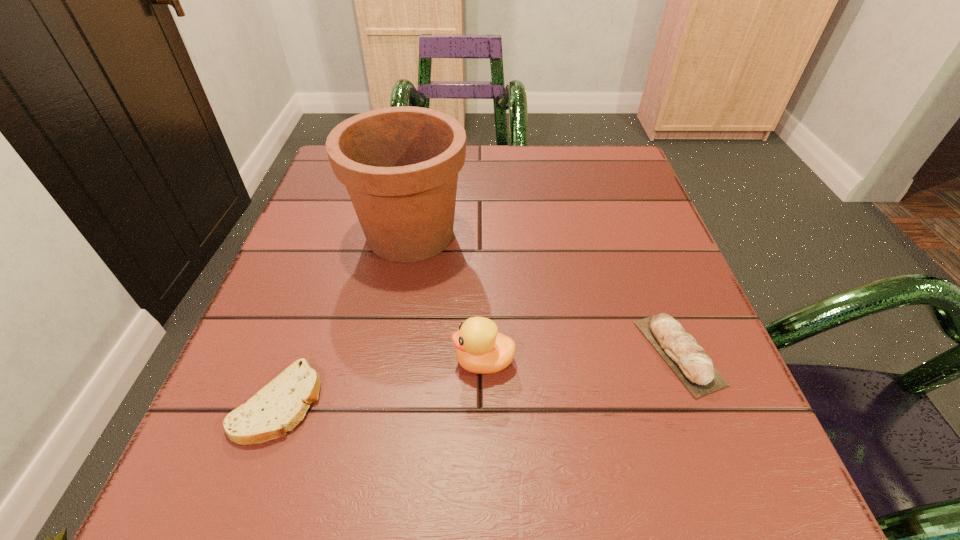
Locate an element on the screen. The width and height of the screenshot is (960, 540). free space at the left edge of the desktop is located at coordinates (346, 253).

The image size is (960, 540). In order to click on free space at the right edge of the desktop in this screenshot , I will do `click(599, 237)`.

At what (x,y) coordinates should I click in order to perform the action: click on vacant space at the near left corner. Please return your answer as a coordinate pair (x, y). Looking at the image, I should click on (241, 475).

The height and width of the screenshot is (540, 960). I want to click on vacant space at the far right corner of the desktop, so click(x=619, y=166).

Locate an element on the screen. Image resolution: width=960 pixels, height=540 pixels. blank region between the third shortest object and the tallest object is located at coordinates (447, 298).

What are the coordinates of `blank region between the duckling and the right pita bread` in the screenshot? It's located at (581, 357).

Identify the location of vacant area that lies between the shortest object and the tallest object. This screenshot has height=540, width=960. (345, 319).

This screenshot has width=960, height=540. Find the location of `vacant area that lies between the shortest object and the tallest object`. vacant area that lies between the shortest object and the tallest object is located at coordinates (345, 319).

At what (x,y) coordinates should I click in order to perform the action: click on free space between the duckling and the flowerpot. Please return your answer as a coordinate pair (x, y). Image resolution: width=960 pixels, height=540 pixels. Looking at the image, I should click on (447, 298).

Identify the location of unoccupied area between the tallest object and the shortest object. (345, 319).